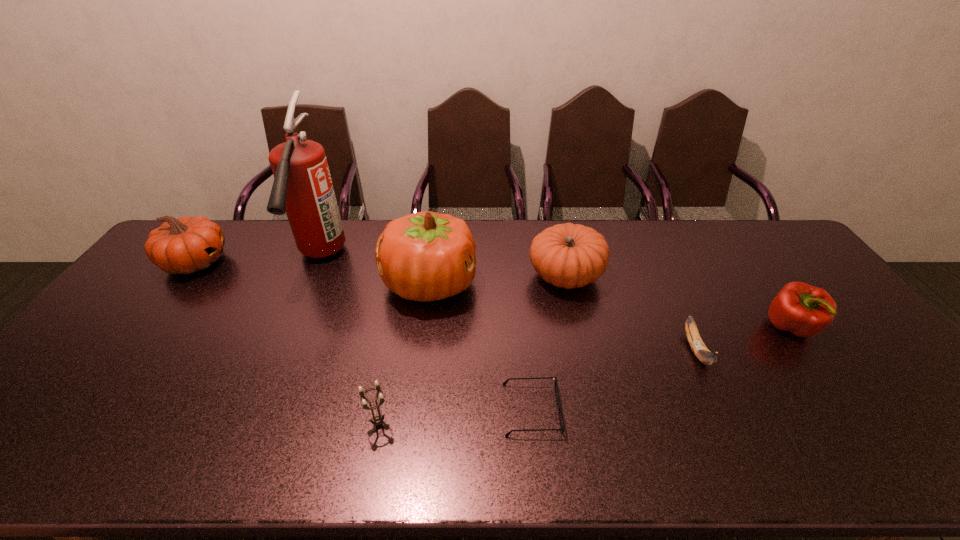
I want to click on candle holder that is at the near edge, so click(377, 419).

Where is `spectacles positioned at the near edge`? spectacles positioned at the near edge is located at coordinates click(562, 427).

Where is `object situated at the left edge`? Image resolution: width=960 pixels, height=540 pixels. object situated at the left edge is located at coordinates (186, 245).

At what (x,y) coordinates should I click in order to perform the action: click on object that is at the right edge. Please return your answer as a coordinate pair (x, y). This screenshot has width=960, height=540. Looking at the image, I should click on (804, 310).

I want to click on object that is at the far left corner, so click(x=186, y=245).

The height and width of the screenshot is (540, 960). In the image, there is a desktop. What are the coordinates of `vacant space at the far edge` in the screenshot? It's located at (518, 231).

You are a GUI agent. You are given a task and a screenshot of the screen. Output one action in this format:
    pyautogui.click(x=<x>, y=<y>)
    Task: Click on the free region at the near edge of the desktop
    Image resolution: width=960 pixels, height=540 pixels.
    Given the screenshot: What is the action you would take?
    pyautogui.click(x=555, y=463)

In the image, there is a desktop. At what (x,y) coordinates should I click in order to perform the action: click on vacant space at the left edge. Please return your answer as a coordinate pair (x, y). Looking at the image, I should click on pos(54,422).

This screenshot has width=960, height=540. I want to click on blank space at the right edge of the desktop, so click(884, 398).

The height and width of the screenshot is (540, 960). What are the coordinates of `vacant space at the near right corner` in the screenshot? It's located at click(932, 437).